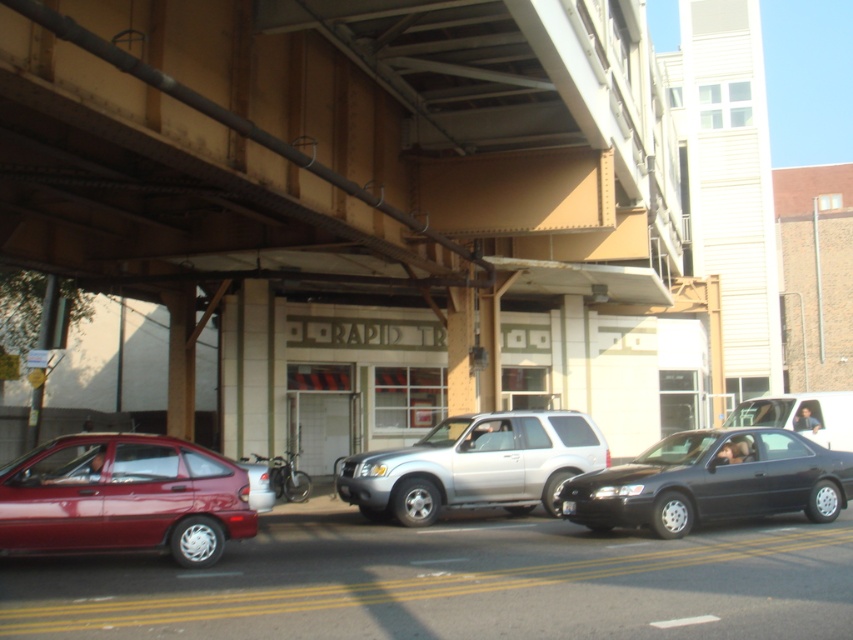
You are a delivery driver needing to park your van between the shiny black sedan at center and the silver metallic suv at center. Based on the scene, can your van fit in the space between them?

The shiny black sedan at center occupies less space than the silver metallic suv at center, so the space between them may be sufficient for your van depending on the exact dimensions. However, without knowing the van size, it is hard to confirm.